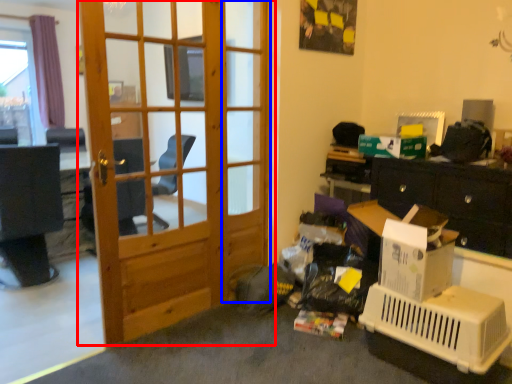
Question: Which of the following is the closest to the observer, door (highlighted by a red box) or screen door (highlighted by a blue box)?

Choices:
 (A) door
 (B) screen door

Answer: (A)